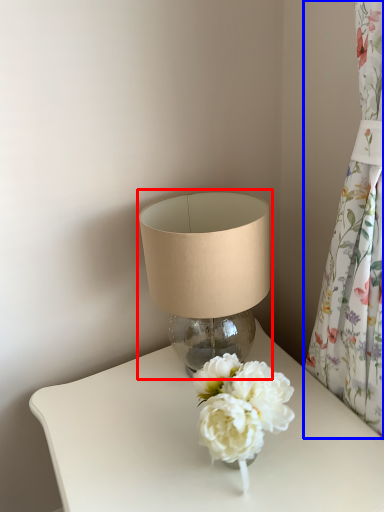
Question: Which object appears farthest to the camera in this image, lamp (highlighted by a red box) or curtain (highlighted by a blue box)?

Choices:
 (A) lamp
 (B) curtain

Answer: (A)